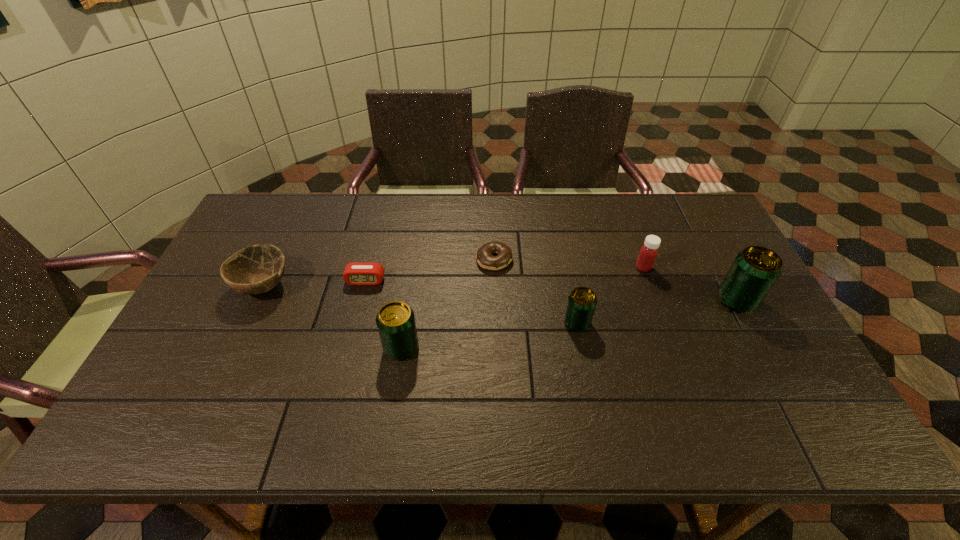
This screenshot has height=540, width=960. What are the coordinates of `free space between the second shortest object and the fourth object from left to right` in the screenshot? It's located at (430, 270).

The height and width of the screenshot is (540, 960). Identify the location of blank region between the sixth shortest object and the sixth object from left to right. (522, 308).

Identify the location of vacant area between the medicine and the fourth object from right to left. This screenshot has width=960, height=540. (568, 264).

The width and height of the screenshot is (960, 540). Find the location of `vacant region between the bowl and the second beer can from left to right`. vacant region between the bowl and the second beer can from left to right is located at coordinates (420, 304).

What are the coordinates of `free spot between the fifth object from left to right and the second shortest beer can` in the screenshot? It's located at (490, 335).

Choose which object is the third nearest neighbor to the shortest object. Please provide its 2D coordinates. Your answer should be formatted as a tuple, i.e. [(x, y)], where the tuple contains the x and y coordinates of a point satisfying the conditions above.

[(357, 273)]

Identify which object is located as the fifth nearest to the second tallest beer can. Please provide its 2D coordinates. Your answer should be formatted as a tuple, i.e. [(x, y)], where the tuple contains the x and y coordinates of a point satisfying the conditions above.

[(648, 253)]

Locate which beer can is the second closest to the leftmost beer can. Please provide its 2D coordinates. Your answer should be formatted as a tuple, i.e. [(x, y)], where the tuple contains the x and y coordinates of a point satisfying the conditions above.

[(755, 270)]

Identify which beer can is the third closest to the second object from left to right. Please provide its 2D coordinates. Your answer should be formatted as a tuple, i.e. [(x, y)], where the tuple contains the x and y coordinates of a point satisfying the conditions above.

[(755, 270)]

The image size is (960, 540). I want to click on vacant space that satisfies the following two spatial constraints: 1. on the front-facing side of the second shortest object; 2. on the right side of the rightmost object, so click(361, 300).